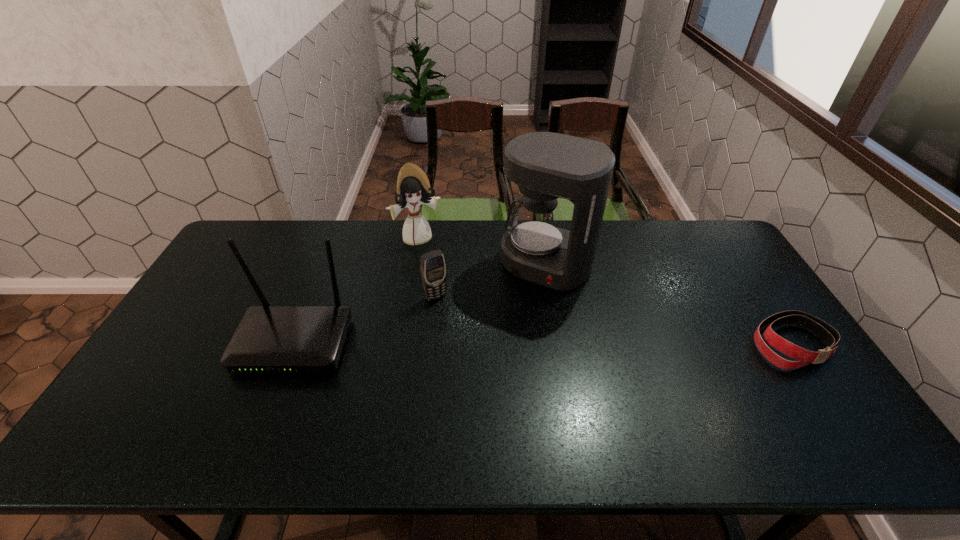
In order to click on vacant point located between the doll and the leftmost object in this screenshot , I will do `click(356, 291)`.

Identify the location of unoccupied position between the tallest object and the doll. (482, 252).

This screenshot has height=540, width=960. I want to click on free space between the coffee maker and the leftmost object, so click(x=420, y=304).

The height and width of the screenshot is (540, 960). In order to click on object that ranks as the second closest to the router in this screenshot , I will do `click(413, 188)`.

Select which object appears as the second closest to the doll. Please provide its 2D coordinates. Your answer should be formatted as a tuple, i.e. [(x, y)], where the tuple contains the x and y coordinates of a point satisfying the conditions above.

[(545, 165)]

This screenshot has width=960, height=540. I want to click on vacant region that satisfies the following two spatial constraints: 1. on the front side of the shortest object; 2. on the right side of the cellular telephone, so click(x=431, y=343).